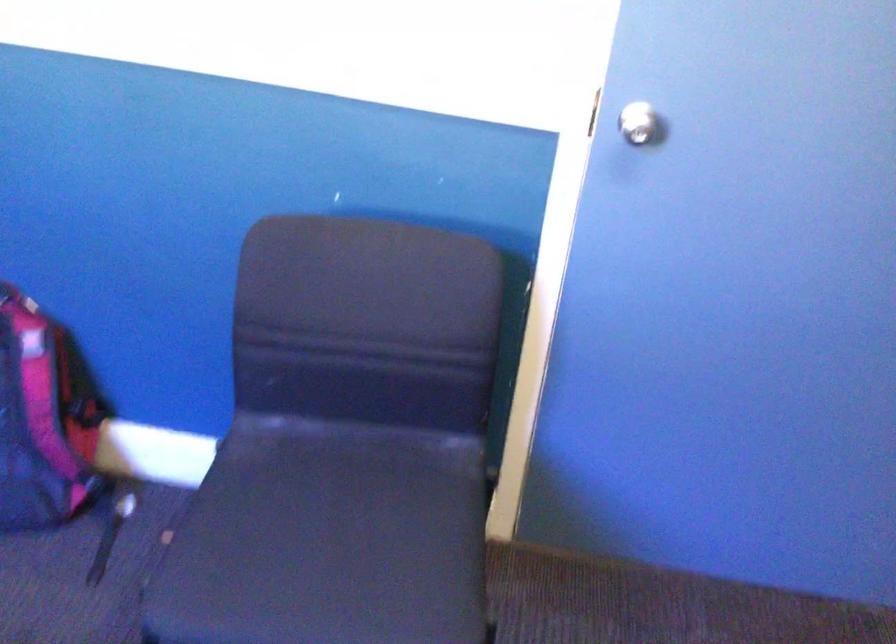
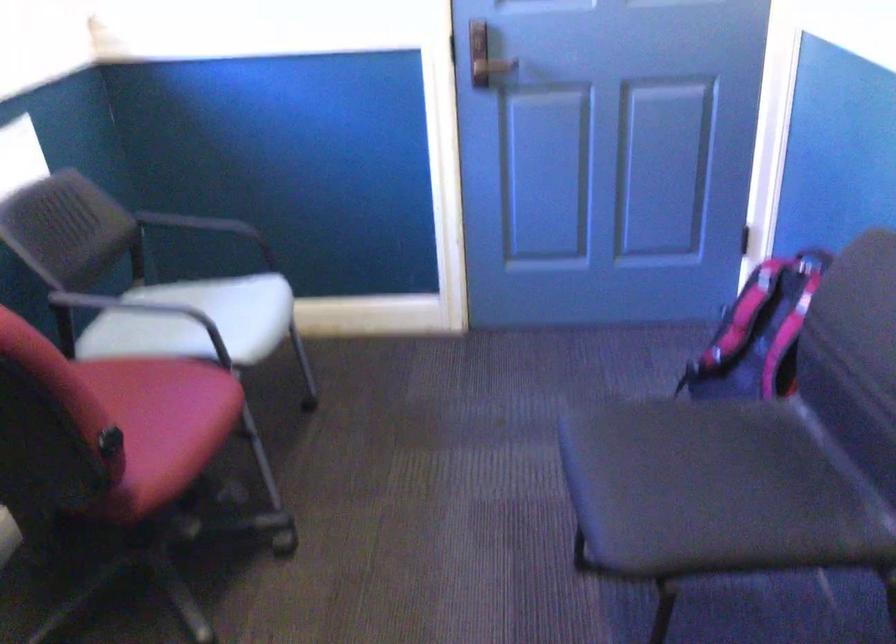
Where in the second image is the point corresponding to (351,529) from the first image?

(698, 485)